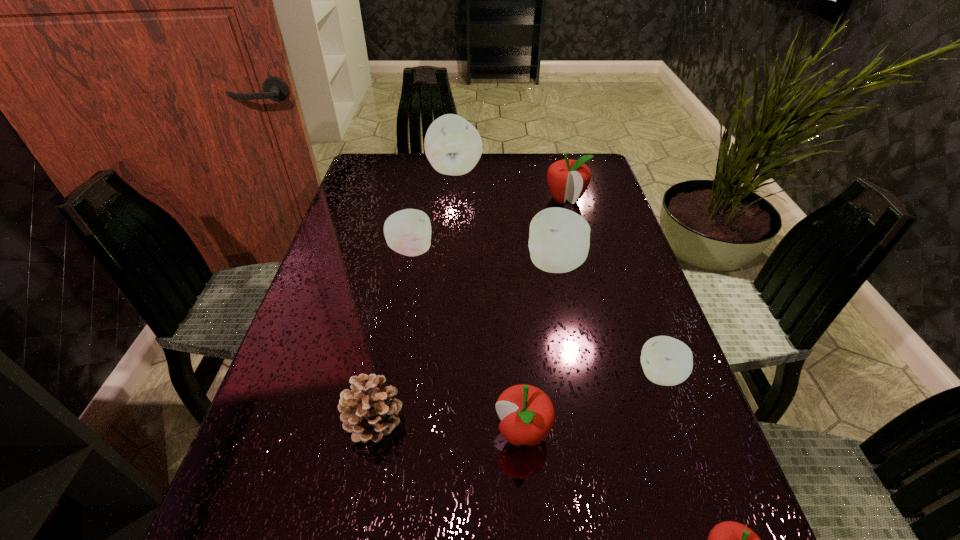
In order to click on the farthest white apple in this screenshot , I will do `click(453, 146)`.

In order to click on the tallest object in this screenshot , I will do `click(453, 146)`.

At what (x,y) coordinates should I click in order to perform the action: click on the second white apple from right to left. Please return your answer as a coordinate pair (x, y). This screenshot has width=960, height=540. Looking at the image, I should click on (559, 239).

Find the location of a particular element. the sixth nearest apple is located at coordinates (x=568, y=179).

The image size is (960, 540). I want to click on the farthest red apple, so click(568, 179).

Find the location of `the second smallest white apple`. the second smallest white apple is located at coordinates (408, 232).

In order to click on the leftmost red apple in this screenshot , I will do `click(527, 415)`.

At what (x,y) coordinates should I click in order to perform the action: click on the second nearest apple. Please return your answer as a coordinate pair (x, y). The height and width of the screenshot is (540, 960). Looking at the image, I should click on (527, 415).

Where is `pinecone`? pinecone is located at coordinates (368, 412).

Image resolution: width=960 pixels, height=540 pixels. In order to click on the nearest white apple in this screenshot , I will do `click(667, 361)`.